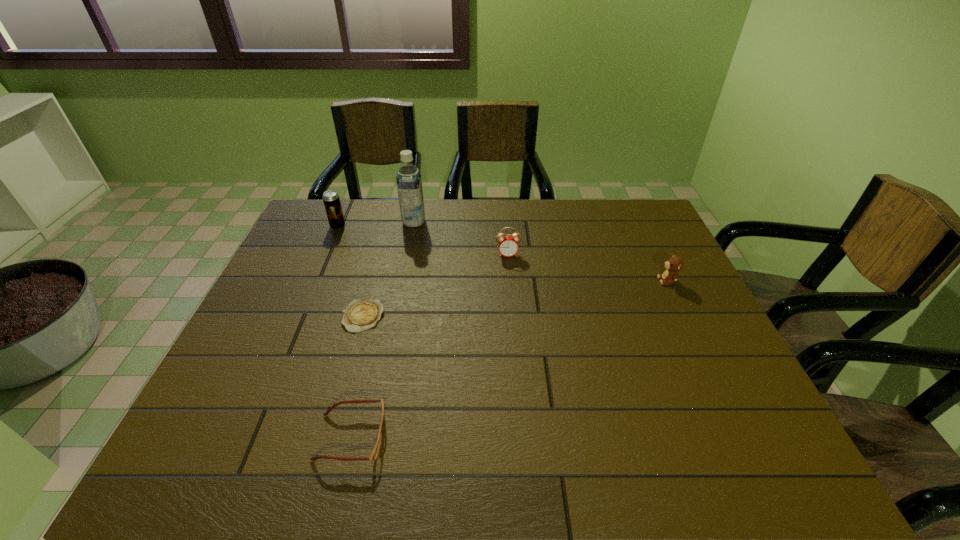
Locate an element on the screen. This screenshot has height=540, width=960. free space that is in between the leftmost object and the shortest object is located at coordinates (350, 271).

Where is `free space that is in between the teddy bear and the soya milk`? The image size is (960, 540). free space that is in between the teddy bear and the soya milk is located at coordinates (540, 251).

Select which object is the fifth closest to the fifth shortest object. Please provide its 2D coordinates. Your answer should be formatted as a tuple, i.e. [(x, y)], where the tuple contains the x and y coordinates of a point satisfying the conditions above.

[(674, 264)]

I want to click on the fifth closest object to the leftmost object, so click(674, 264).